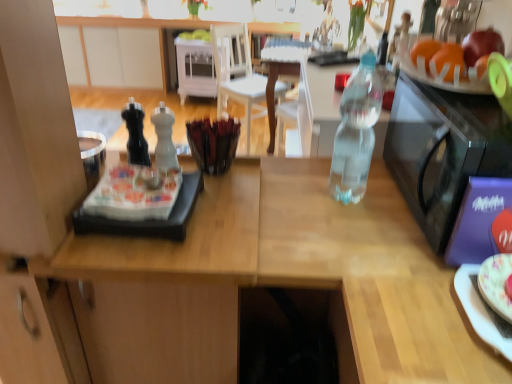
In order to click on empty space that is in between white matte pepper shaker at center, which is the second bottle in right-to-left order, and porcelain floral plate at right in this screenshot , I will do `click(333, 241)`.